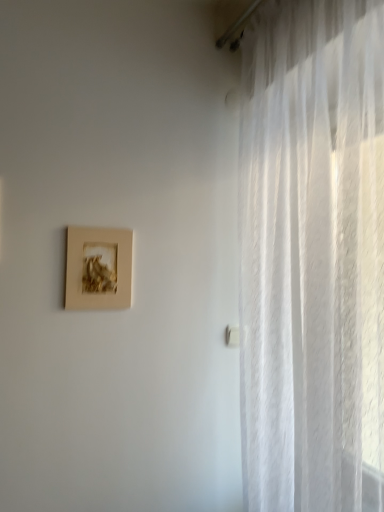
Question: Does matte gold picture frame at upper left have a greater height compared to white sheer curtain at right?

Choices:
 (A) no
 (B) yes

Answer: (A)

Question: Considering the relative positions of matte gold picture frame at upper left and white sheer curtain at right in the image provided, is matte gold picture frame at upper left in front of white sheer curtain at right?

Choices:
 (A) yes
 (B) no

Answer: (B)

Question: Does matte gold picture frame at upper left have a greater width compared to white sheer curtain at right?

Choices:
 (A) no
 (B) yes

Answer: (A)

Question: Is matte gold picture frame at upper left oriented away from white sheer curtain at right?

Choices:
 (A) no
 (B) yes

Answer: (A)

Question: Is matte gold picture frame at upper left outside white sheer curtain at right?

Choices:
 (A) no
 (B) yes

Answer: (B)

Question: From a real-world perspective, is matte gold picture frame at upper left located higher than white sheer curtain at right?

Choices:
 (A) yes
 (B) no

Answer: (A)

Question: Is white sheer curtain at right oriented away from matte gold picture frame at upper left?

Choices:
 (A) no
 (B) yes

Answer: (A)

Question: Can you confirm if white sheer curtain at right is taller than matte gold picture frame at upper left?

Choices:
 (A) no
 (B) yes

Answer: (B)

Question: From a real-world perspective, is white sheer curtain at right under matte gold picture frame at upper left?

Choices:
 (A) no
 (B) yes

Answer: (B)

Question: Is white sheer curtain at right placed right next to matte gold picture frame at upper left?

Choices:
 (A) yes
 (B) no

Answer: (B)

Question: From a real-world perspective, is white sheer curtain at right on top of matte gold picture frame at upper left?

Choices:
 (A) yes
 (B) no

Answer: (B)

Question: Would you say matte gold picture frame at upper left is part of white sheer curtain at right's contents?

Choices:
 (A) no
 (B) yes

Answer: (A)

Question: Considering the positions of point (274, 41) and point (122, 291), is point (274, 41) closer or farther from the camera than point (122, 291)?

Choices:
 (A) farther
 (B) closer

Answer: (B)